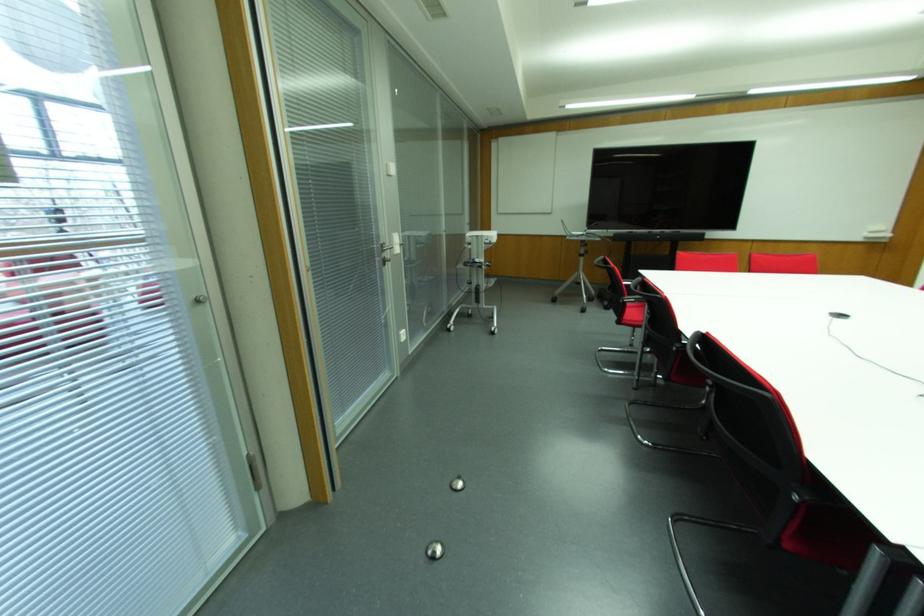
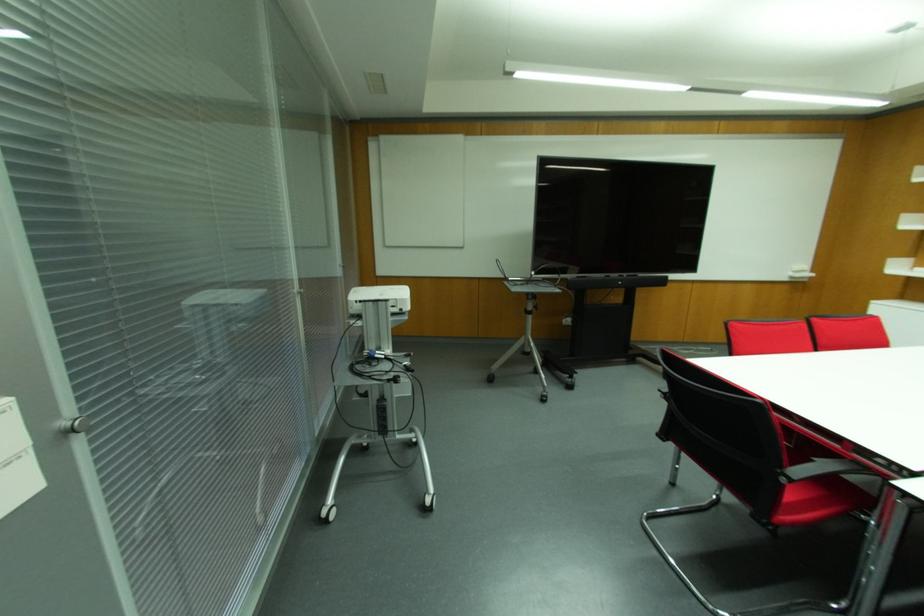
Question: Which direction would the cameraman need to move to produce the second image? Reply with the corresponding letter.

Choices:
 (A) Left
 (B) Right
 (C) Forward
 (D) Backward

Answer: (C)